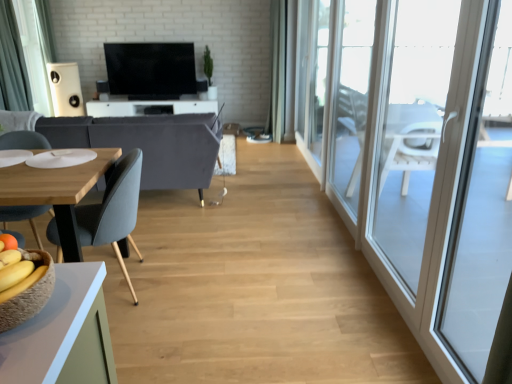
Question: Which direction should I rotate to face white glossy tv stand at center, the second table positioned from the bottom, — up or down?

Choices:
 (A) up
 (B) down

Answer: (A)

Question: Would you say transparent glass window at right, the 3th window from the front, is outside velvet grey couch at left?

Choices:
 (A) no
 (B) yes

Answer: (B)

Question: Does transparent glass window at right, marked as the 1th window in a back-to-front arrangement, appear on the left side of velvet grey couch at left?

Choices:
 (A) no
 (B) yes

Answer: (A)

Question: Is transparent glass window at right, marked as the 1th window in a back-to-front arrangement, smaller than velvet grey couch at left?

Choices:
 (A) yes
 (B) no

Answer: (A)

Question: Is transparent glass window at right, marked as the 1th window in a back-to-front arrangement, in contact with velvet grey couch at left?

Choices:
 (A) yes
 (B) no

Answer: (B)

Question: Does transparent glass window at right, marked as the 1th window in a back-to-front arrangement, come behind velvet grey couch at left?

Choices:
 (A) yes
 (B) no

Answer: (A)

Question: Can you confirm if transparent glass window at right, the 3th window from the front, is taller than velvet grey couch at left?

Choices:
 (A) yes
 (B) no

Answer: (A)

Question: Is dark gray fabric curtain at left turned away from yellow matte bananas at lower left?

Choices:
 (A) no
 (B) yes

Answer: (A)

Question: Can we say dark gray fabric curtain at left lies outside yellow matte bananas at lower left?

Choices:
 (A) yes
 (B) no

Answer: (A)

Question: Is dark gray fabric curtain at left in contact with yellow matte bananas at lower left?

Choices:
 (A) no
 (B) yes

Answer: (A)

Question: Is dark gray fabric curtain at left oriented towards yellow matte bananas at lower left?

Choices:
 (A) no
 (B) yes

Answer: (A)

Question: Is dark gray fabric curtain at left taller than yellow matte bananas at lower left?

Choices:
 (A) yes
 (B) no

Answer: (A)

Question: From a real-world perspective, is dark gray fabric curtain at left positioned over yellow matte bananas at lower left based on gravity?

Choices:
 (A) yes
 (B) no

Answer: (A)

Question: From the image's perspective, is flat screen tv at center located beneath dark gray fabric curtain at left?

Choices:
 (A) no
 (B) yes

Answer: (A)